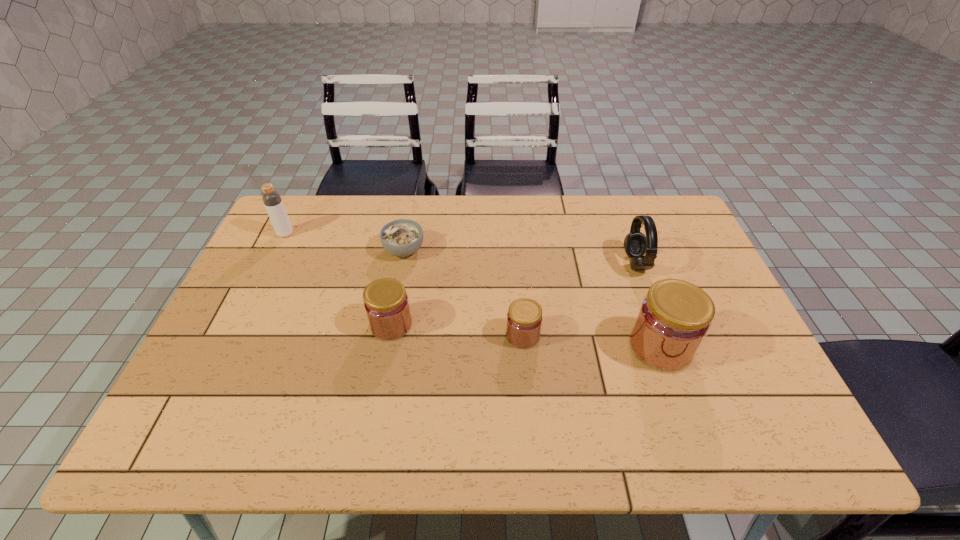
I want to click on blank region between the tallest jam and the second shortest object, so click(x=591, y=341).

Where is `free spot between the leftmost object and the leftmost jam`? The image size is (960, 540). free spot between the leftmost object and the leftmost jam is located at coordinates (338, 279).

The width and height of the screenshot is (960, 540). Identify the location of unoccupied area between the shortest jam and the headset. (579, 299).

Where is `vacant space that's between the shortest jam and the headset`? Image resolution: width=960 pixels, height=540 pixels. vacant space that's between the shortest jam and the headset is located at coordinates (579, 299).

Where is `free spot between the leftmost object and the tallest jam`? The image size is (960, 540). free spot between the leftmost object and the tallest jam is located at coordinates (473, 291).

Identify the location of free space between the headset and the second jam from right to left. (579, 299).

You are a GUI agent. You are given a task and a screenshot of the screen. Output one action in this format:
    pyautogui.click(x=<x>, y=<y>)
    Task: Click on the vacant region between the tallest jam and the soup bowl
    This screenshot has width=960, height=540.
    Given the screenshot: What is the action you would take?
    pyautogui.click(x=532, y=299)

Locate an element on the screen. Image resolution: width=960 pixels, height=540 pixels. the second closest object to the bottle is located at coordinates (386, 303).

Point out which object is positioned as the third nearest to the rightmost jam. Please provide its 2D coordinates. Your answer should be formatted as a tuple, i.e. [(x, y)], where the tuple contains the x and y coordinates of a point satisfying the conditions above.

[(386, 303)]

Choose which jam is the second nearest neighbor to the soup bowl. Please provide its 2D coordinates. Your answer should be formatted as a tuple, i.e. [(x, y)], where the tuple contains the x and y coordinates of a point satisfying the conditions above.

[(524, 318)]